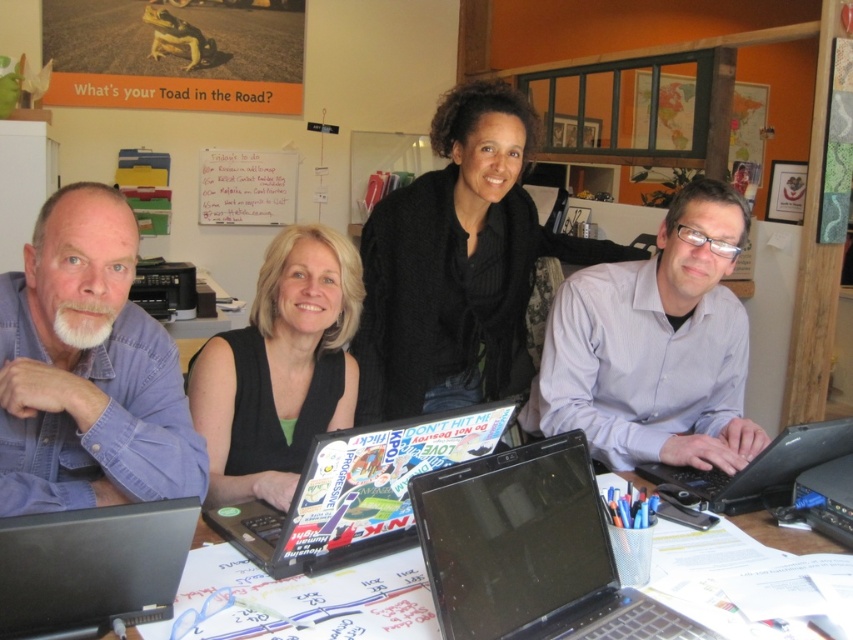
Is black glossy laptop at center bigger than black matte shirt at center?

Incorrect, black glossy laptop at center is not larger than black matte shirt at center.

Is black glossy laptop at center wider than black matte shirt at center?

Correct, the width of black glossy laptop at center exceeds that of black matte shirt at center.

Does point (486, 582) come farther from viewer compared to point (196, 355)?

That is False.

The height and width of the screenshot is (640, 853). I want to click on black glossy laptop at center, so click(x=531, y=552).

Between black knitwear at center and white paper at center, which one has less height?

Standing shorter between the two is white paper at center.

Can you confirm if black knitwear at center is positioned above white paper at center?

Indeed, black knitwear at center is positioned over white paper at center.

You are a GUI agent. You are given a task and a screenshot of the screen. Output one action in this format:
    pyautogui.click(x=<x>, y=<y>)
    Task: Click on the black knitwear at center
    The height and width of the screenshot is (640, 853).
    Given the screenshot: What is the action you would take?
    pyautogui.click(x=450, y=262)

Image resolution: width=853 pixels, height=640 pixels. What are the coordinates of `black knitwear at center` in the screenshot? It's located at (450, 262).

Can you confirm if black knitwear at center is thinner than black matte laptop at lower left?

No, black knitwear at center is not thinner than black matte laptop at lower left.

What do you see at coordinates (450, 262) in the screenshot?
I see `black knitwear at center` at bounding box center [450, 262].

Does point (412, 209) lie in front of point (146, 525)?

No, it is not.

Identify the location of black knitwear at center. The height and width of the screenshot is (640, 853). (450, 262).